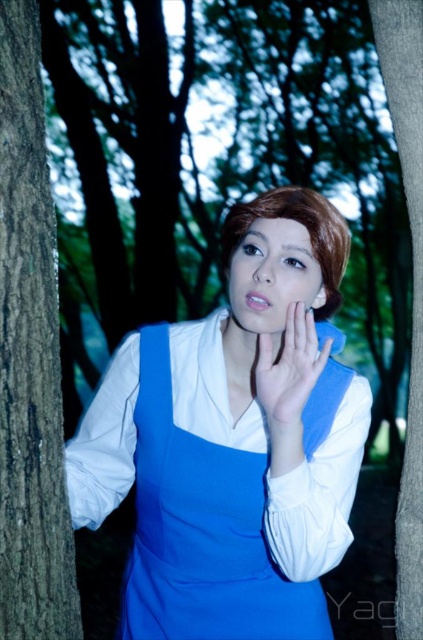
Question: Does smooth brown bark at left have a greater width compared to smooth brown tree trunk at center?

Choices:
 (A) no
 (B) yes

Answer: (A)

Question: Does smooth brown bark at left have a lesser width compared to matte skin hand at center?

Choices:
 (A) no
 (B) yes

Answer: (B)

Question: Which of the following is the closest to the observer?

Choices:
 (A) smooth brown bark at left
 (B) blue fabric dress at center

Answer: (A)

Question: Does blue fabric dress at center have a greater width compared to smooth brown tree trunk at center?

Choices:
 (A) no
 (B) yes

Answer: (B)

Question: Which object appears farthest from the camera in this image?

Choices:
 (A) smooth brown bark at left
 (B) blue fabric dress at center
 (C) matte skin hand at center
 (D) smooth brown hair at center

Answer: (D)

Question: Which of these objects is positioned closest to the smooth brown hair at center?

Choices:
 (A) smooth brown bark at left
 (B) blue fabric dress at center

Answer: (B)